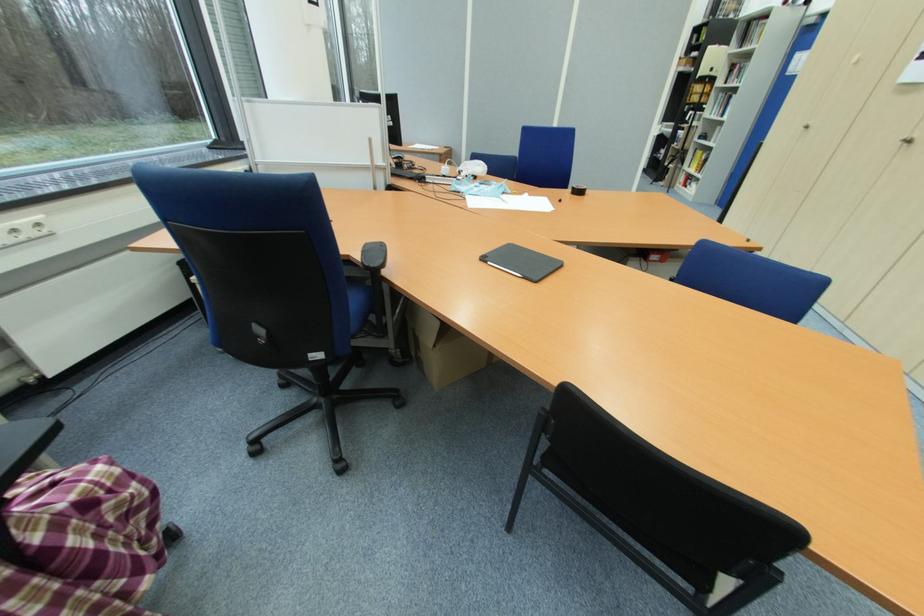
The height and width of the screenshot is (616, 924). I want to click on black tape roll, so click(x=578, y=190).